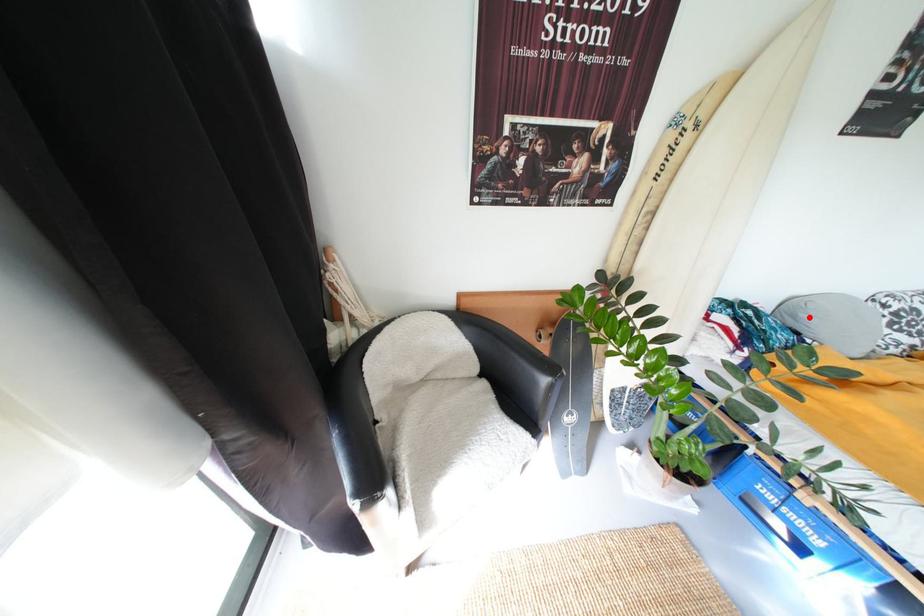
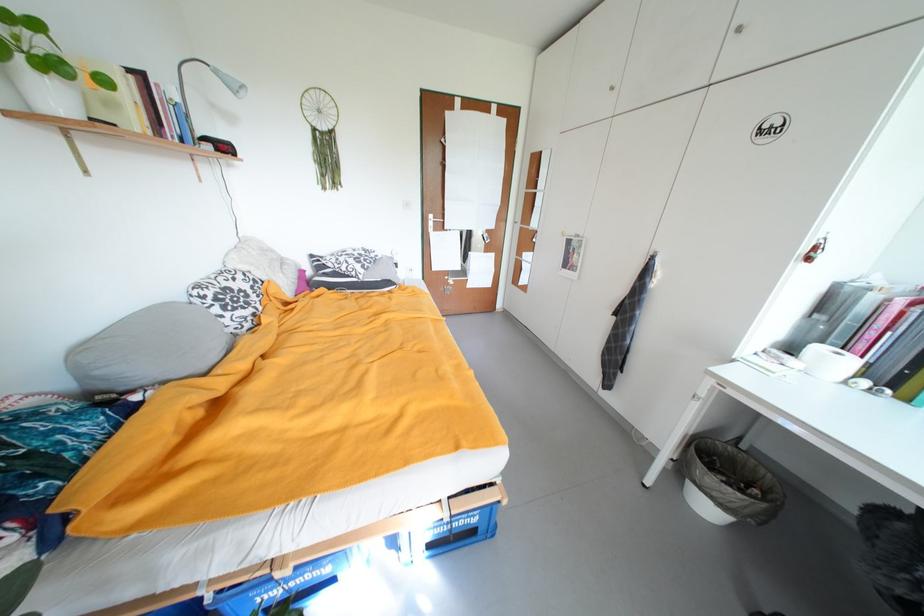
Where in the second image is the point corresponding to the highlighted location from the first image?

(105, 374)